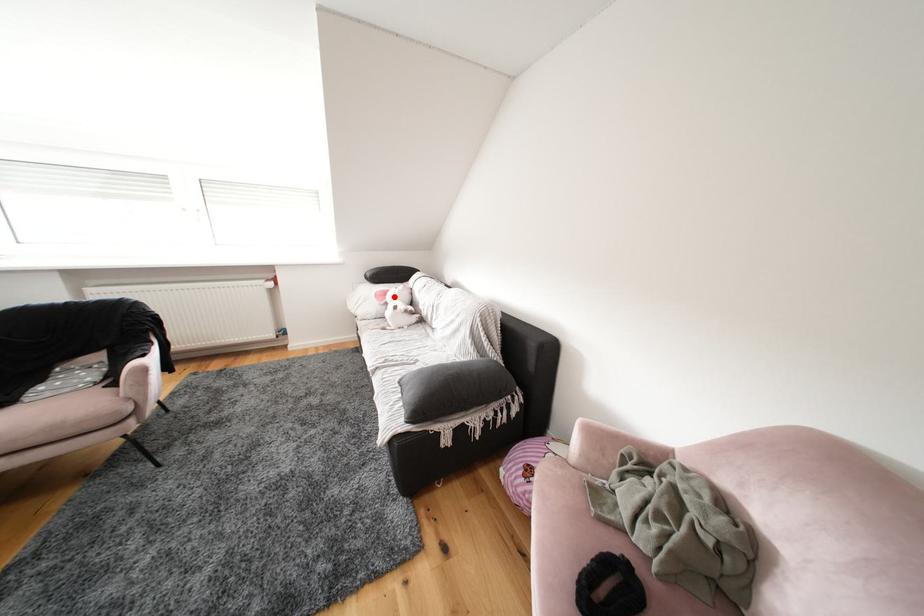
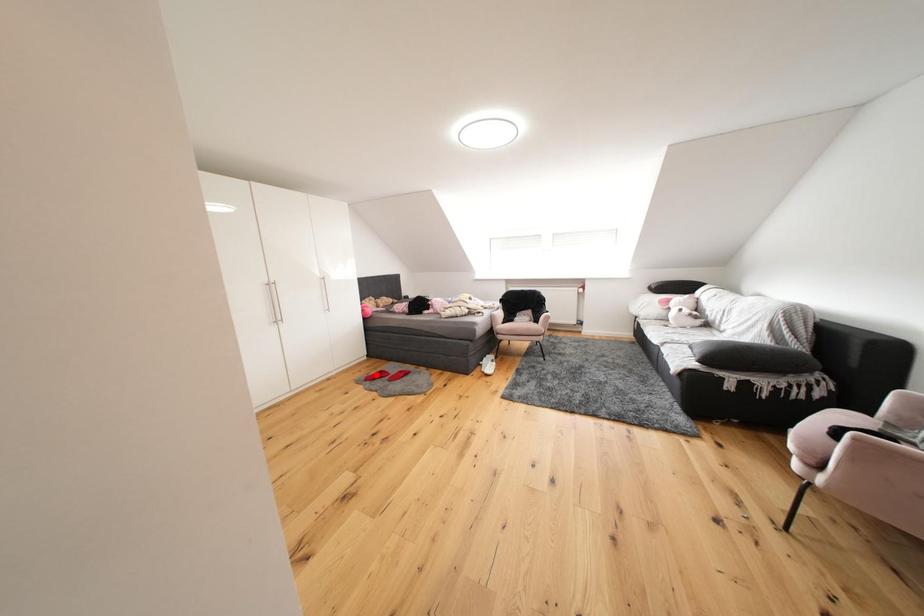
I am providing you with two images of the same scene from different viewpoints. A red point is marked on the first image and another point is marked on the second image. Are the points marked in image1 and image2 representing the same 3D position?

No